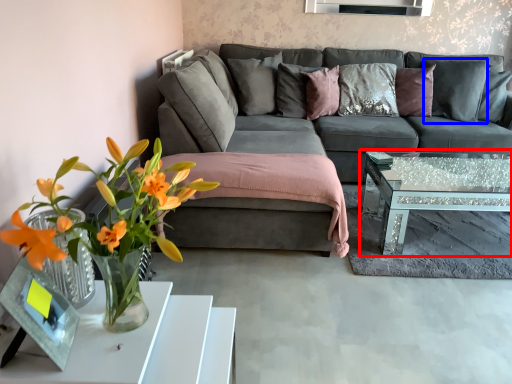
Question: Which object is closer to the camera taking this photo, coffee table (highlighted by a red box) or pillow (highlighted by a blue box)?

Choices:
 (A) coffee table
 (B) pillow

Answer: (A)